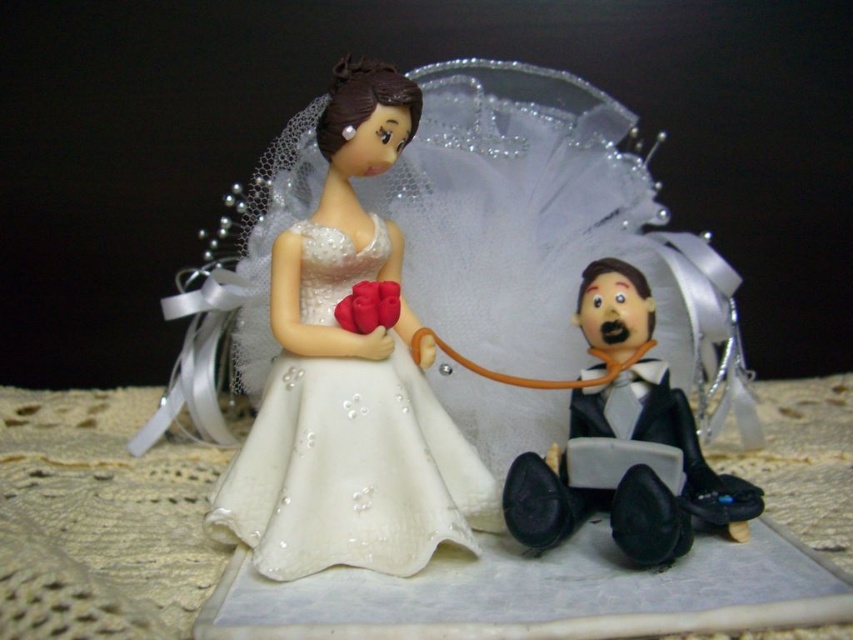
You are standing at the point marked as point (404,364) and want to take a photo of the cake topper. The camera you are using has a focal length of 35mm and an aperture of f2.8. Considering the distance between you and the cake topper, will the depth of field be sufficient to keep both the bride and groom in focus?

The distance between point (404,364) and the camera is 36.25 inches. With a 35mm lens and f2.8 aperture, the depth of field at this distance may be limited. To ensure both the bride and groom are in focus, it might be advisable to use a smaller aperture or focus on a point between them.

You are standing in front of the decorative figurine set of the bride and groom. There are two points marked on the image at coordinates point (334,147) and point (677,408). Which point is closer to you?

Point (334,147) is closer to you because it is further to the viewer than point (677,408).

You are a decorator arranging a wedding cake topper. The cake has a flat surface. You need to place the satin white dress at upper left and the black glossy suit at lower right on the cake. What is the minimum distance you need to keep between them to ensure they don not touch each other?

The minimum distance you need to keep between the satin white dress at upper left and the black glossy suit at lower right is 19.55 centimeters to ensure they do not touch each other.